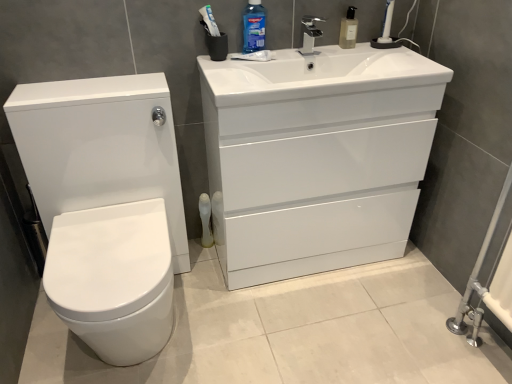
The width and height of the screenshot is (512, 384). Find the location of `satin nickel faucet at upper center`. satin nickel faucet at upper center is located at coordinates (310, 34).

Image resolution: width=512 pixels, height=384 pixels. What are the coordinates of `white plastic toilet brush at lower center` in the screenshot? It's located at (205, 220).

From the picture: In order to face translucent plastic soap dispenser at upper center, the first cleaning product from the right, should I rotate leftwards or rightwards?

To align with it, rotate right about 12.680°.

The image size is (512, 384). I want to click on white glossy cabinet at upper right, so click(x=317, y=157).

Where is `blue glossy mouthwash at upper center, the first cleaning product in the left-to-right sequence`? This screenshot has height=384, width=512. blue glossy mouthwash at upper center, the first cleaning product in the left-to-right sequence is located at coordinates (254, 27).

How different are the orientations of satin nickel faucet at upper center and blue glossy mouthwash at upper center, the 2th cleaning product from the right, in degrees?

The angle between the facing direction of satin nickel faucet at upper center and the facing direction of blue glossy mouthwash at upper center, the 2th cleaning product from the right, is 0.00062 degrees.

Is satin nickel faucet at upper center behind blue glossy mouthwash at upper center, the 2th cleaning product from the right?

That is True.

Is point (314, 38) positioned behind point (264, 22)?

Yes, point (314, 38) is farther from viewer.

Is satin nickel faucet at upper center facing away from blue glossy mouthwash at upper center, the 2th cleaning product from the right?

No, satin nickel faucet at upper center is not facing away from blue glossy mouthwash at upper center, the 2th cleaning product from the right.

Does point (309, 39) come closer to viewer compared to point (206, 213)?

Yes, point (309, 39) is in front of point (206, 213).

Considering the positions of objects satin nickel faucet at upper center and white plastic toilet brush at lower center in the image provided, who is more to the left, satin nickel faucet at upper center or white plastic toilet brush at lower center?

From the viewer's perspective, white plastic toilet brush at lower center appears more on the left side.

Based on the photo, who is bigger, satin nickel faucet at upper center or white plastic toilet brush at lower center?

white plastic toilet brush at lower center.

What's the angular difference between satin nickel faucet at upper center and white plastic toilet brush at lower center's facing directions?

satin nickel faucet at upper center and white plastic toilet brush at lower center are facing 0.000953 degrees away from each other.

Is white plastic toilet brush at lower center closer to the viewer compared to white glossy toilet at left?

No, white plastic toilet brush at lower center is further to the viewer.

Based on the photo, is white plastic toilet brush at lower center positioned far away from white glossy toilet at left?

They are positioned close to each other.

Is white plastic toilet brush at lower center aimed at white glossy toilet at left?

No, white plastic toilet brush at lower center is not turned towards white glossy toilet at left.

Based on the photo, considering the sizes of objects satin nickel faucet at upper center and translucent plastic soap dispenser at upper center, positioned as the 2th cleaning product in left-to-right order, in the image provided, who is shorter, satin nickel faucet at upper center or translucent plastic soap dispenser at upper center, positioned as the 2th cleaning product in left-to-right order,?

With less height is satin nickel faucet at upper center.

From the image's perspective, between satin nickel faucet at upper center and translucent plastic soap dispenser at upper center, the first cleaning product from the right, who is located below?

satin nickel faucet at upper center, from the image's perspective.

Is satin nickel faucet at upper center positioned with its back to translucent plastic soap dispenser at upper center, the first cleaning product from the right?

That's not correct — satin nickel faucet at upper center is not looking away from translucent plastic soap dispenser at upper center, the first cleaning product from the right.

Is satin nickel faucet at upper center touching translucent plastic soap dispenser at upper center, positioned as the 2th cleaning product in left-to-right order?

No, satin nickel faucet at upper center is not touching translucent plastic soap dispenser at upper center, positioned as the 2th cleaning product in left-to-right order.

Between point (375, 91) and point (163, 155), which one is positioned in front?

The point (375, 91) is closer to the camera.

From the picture: Is white glossy cabinet at upper right facing towards white glossy toilet at left?

No, white glossy cabinet at upper right does not turn towards white glossy toilet at left.

From a real-world perspective, which is physically below, white glossy cabinet at upper right or white glossy toilet at left?

In real-world perspective, white glossy toilet at left is lower.

Considering the relative positions of blue glossy mouthwash at upper center, the first cleaning product in the left-to-right sequence, and white glossy cabinet at upper right in the image provided, is blue glossy mouthwash at upper center, the first cleaning product in the left-to-right sequence, to the left of white glossy cabinet at upper right from the viewer's perspective?

Indeed, blue glossy mouthwash at upper center, the first cleaning product in the left-to-right sequence, is positioned on the left side of white glossy cabinet at upper right.

From the picture: Does blue glossy mouthwash at upper center, the 2th cleaning product from the right, lie behind white glossy cabinet at upper right?

Yes.

Is blue glossy mouthwash at upper center, the 2th cleaning product from the right, oriented away from white glossy cabinet at upper right?

No.

What's the angular difference between blue glossy mouthwash at upper center, the first cleaning product in the left-to-right sequence, and white glossy cabinet at upper right's facing directions?

The angle between the facing direction of blue glossy mouthwash at upper center, the first cleaning product in the left-to-right sequence, and the facing direction of white glossy cabinet at upper right is 0.805 degrees.

Consider the image. Between blue glossy mouthwash at upper center, the first cleaning product in the left-to-right sequence, and white glossy drawer at center, which one is positioned in front?

white glossy drawer at center is closer to the camera.

Would you say blue glossy mouthwash at upper center, the 2th cleaning product from the right, is outside white glossy drawer at center?

blue glossy mouthwash at upper center, the 2th cleaning product from the right, is positioned outside white glossy drawer at center.

Does blue glossy mouthwash at upper center, the first cleaning product in the left-to-right sequence, touch white glossy drawer at center?

No, blue glossy mouthwash at upper center, the first cleaning product in the left-to-right sequence, is not in contact with white glossy drawer at center.

Locate an element on the screen. The height and width of the screenshot is (384, 512). tap that appears behind the blue glossy mouthwash at upper center, the 2th cleaning product from the right is located at coordinates (310, 34).

Locate an element on the screen. tap above the white plastic toilet brush at lower center (from the image's perspective) is located at coordinates (310, 34).

When comparing their distances from white glossy drawer at center, does blue glossy mouthwash at upper center, the first cleaning product in the left-to-right sequence, or white glossy cabinet at upper right seem further?

The object further to white glossy drawer at center is blue glossy mouthwash at upper center, the first cleaning product in the left-to-right sequence.

When comparing their distances from white glossy toilet at left, does satin nickel faucet at upper center or white plastic toilet brush at lower center seem closer?

white plastic toilet brush at lower center lies closer to white glossy toilet at left than the other object.

Estimate the real-world distances between objects in this image. Which object is further from translucent plastic soap dispenser at upper center, the first cleaning product from the right, white plastic toilet brush at lower center or white glossy cabinet at upper right?

Based on the image, white plastic toilet brush at lower center appears to be further to translucent plastic soap dispenser at upper center, the first cleaning product from the right.

Which object lies further to the anchor point white glossy cabinet at upper right, white glossy drawer at center or blue glossy mouthwash at upper center, the 2th cleaning product from the right?

blue glossy mouthwash at upper center, the 2th cleaning product from the right, is further to white glossy cabinet at upper right.

From the image, which object appears to be farther from translucent plastic soap dispenser at upper center, the first cleaning product from the right, blue glossy mouthwash at upper center, the first cleaning product in the left-to-right sequence, or white glossy cabinet at upper right?

The object further to translucent plastic soap dispenser at upper center, the first cleaning product from the right, is white glossy cabinet at upper right.

Considering their positions, is white plastic toilet brush at lower center positioned closer to white glossy toilet at left than white glossy cabinet at upper right?

white glossy cabinet at upper right.

Considering their positions, is white glossy cabinet at upper right positioned further to white plastic toilet brush at lower center than satin nickel faucet at upper center?

satin nickel faucet at upper center lies further to white plastic toilet brush at lower center than the other object.

Looking at this image, based on their spatial positions, is white glossy cabinet at upper right or blue glossy mouthwash at upper center, the first cleaning product in the left-to-right sequence, closer to translucent plastic soap dispenser at upper center, positioned as the 2th cleaning product in left-to-right order?

Among the two, blue glossy mouthwash at upper center, the first cleaning product in the left-to-right sequence, is located nearer to translucent plastic soap dispenser at upper center, positioned as the 2th cleaning product in left-to-right order.

Image resolution: width=512 pixels, height=384 pixels. Identify the location of drawer between blue glossy mouthwash at upper center, the first cleaning product in the left-to-right sequence, and translucent plastic soap dispenser at upper center, positioned as the 2th cleaning product in left-to-right order, in the horizontal direction. (328, 111).

Image resolution: width=512 pixels, height=384 pixels. Find the location of `tap that lies between translucent plastic soap dispenser at upper center, the first cleaning product from the right, and white glossy drawer at center from top to bottom`. tap that lies between translucent plastic soap dispenser at upper center, the first cleaning product from the right, and white glossy drawer at center from top to bottom is located at coordinates (310, 34).

Identify the location of cleaning product that lies between translucent plastic soap dispenser at upper center, the first cleaning product from the right, and white plastic toilet brush at lower center from top to bottom. (254, 27).

The height and width of the screenshot is (384, 512). In order to click on cleaning product situated between white glossy toilet at left and white glossy drawer at center from left to right in this screenshot , I will do `click(254, 27)`.